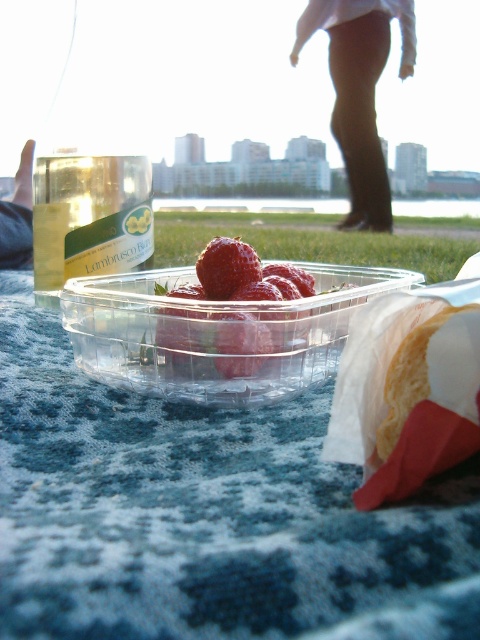
Which of these two, black fabric pants at upper center or skinny jeans at lower left, stands taller?

With more height is black fabric pants at upper center.

Which of these two, black fabric pants at upper center or skinny jeans at lower left, stands shorter?

skinny jeans at lower left

This screenshot has height=640, width=480. Identify the location of black fabric pants at upper center. (360, 92).

The height and width of the screenshot is (640, 480). Identify the location of black fabric pants at upper center. (360, 92).

Is point (13, 605) positioned behind point (28, 168)?

No.

Is point (83, 468) closer to camera compared to point (29, 154)?

Yes, point (83, 468) is in front of point (29, 154).

Does point (184, 572) lie behind point (17, 246)?

No, it is in front of (17, 246).

Locate an element on the screen. This screenshot has width=480, height=640. blue knitted tablecloth at center is located at coordinates (204, 513).

Who is positioned more to the left, blue knitted tablecloth at center or black fabric pants at upper center?

Positioned to the left is blue knitted tablecloth at center.

Is blue knitted tablecloth at center positioned behind black fabric pants at upper center?

No, it is in front of black fabric pants at upper center.

Is point (251, 547) positioned before point (410, 10)?

Yes, it is in front of point (410, 10).

This screenshot has height=640, width=480. In order to click on blue knitted tablecloth at center in this screenshot , I will do `click(204, 513)`.